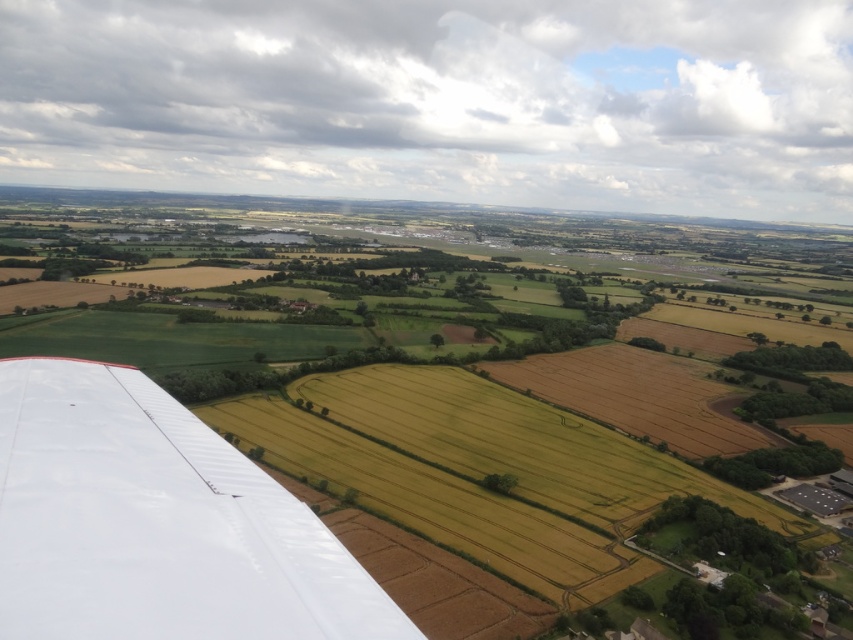
Is point (407, 481) in front of point (189, 461)?

No, it is not.

Find the location of a particular element. green grassy field at center is located at coordinates (453, 396).

Locate an element on the screen. Image resolution: width=853 pixels, height=640 pixels. green grassy field at center is located at coordinates (453, 396).